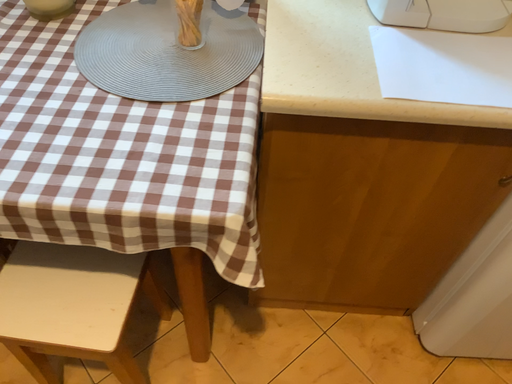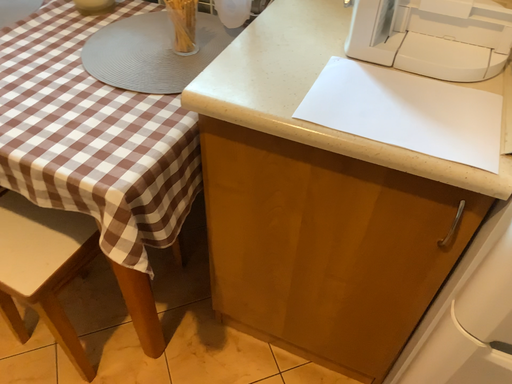
Question: How did the camera likely rotate when shooting the video?

Choices:
 (A) rotated right
 (B) rotated left

Answer: (B)